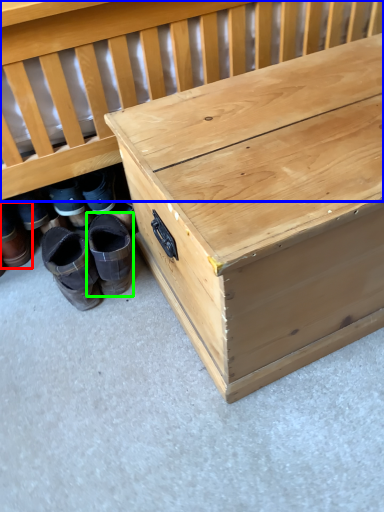
Question: Which object is the closest to the footwear (highlighted by a red box)? Choose among these: infant bed (highlighted by a blue box) or footwear (highlighted by a green box).

Choices:
 (A) infant bed
 (B) footwear

Answer: (B)